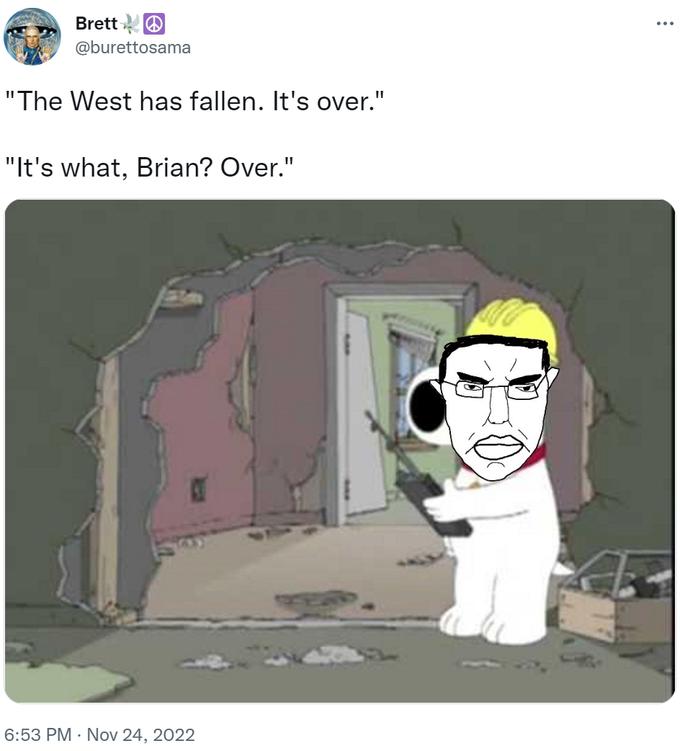
Locate an element on the screen. This screenshot has width=680, height=751. electrical socket is located at coordinates (197, 493).